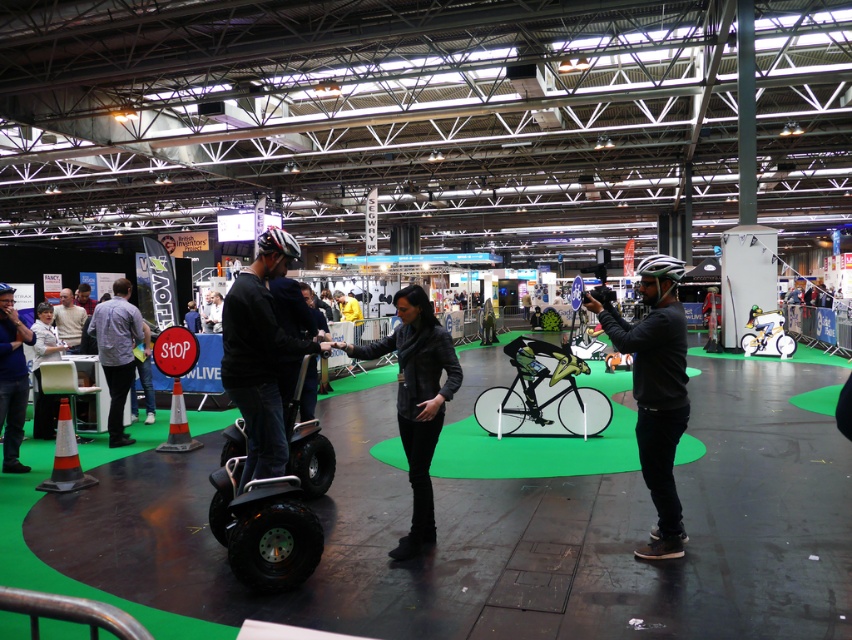
Between point (263, 253) and point (188, 328), which one is positioned behind?

Point (188, 328)

Is point (265, 424) less distant than point (196, 330)?

That is True.

Where is `black matte segway at center`? This screenshot has height=640, width=852. black matte segway at center is located at coordinates (258, 355).

Between point (106, 349) and point (188, 301), which one is positioned behind?

Positioned behind is point (188, 301).

Does light blue shirt at center appear on the left side of dark blue jacket at center?

In fact, light blue shirt at center is to the right of dark blue jacket at center.

Describe the element at coordinates (116, 353) in the screenshot. Image resolution: width=852 pixels, height=640 pixels. I see `light blue shirt at center` at that location.

This screenshot has width=852, height=640. I want to click on light blue shirt at center, so click(116, 353).

Between black rubber segway at center and black matte segway at center, which one is positioned higher?

black matte segway at center is above.

Looking at this image, can you confirm if black rubber segway at center is positioned to the right of black matte segway at center?

Incorrect, black rubber segway at center is not on the right side of black matte segway at center.

Is point (252, 529) farther from camera compared to point (232, 292)?

No, (252, 529) is closer to viewer.

This screenshot has width=852, height=640. Identify the location of black rubber segway at center. (271, 504).